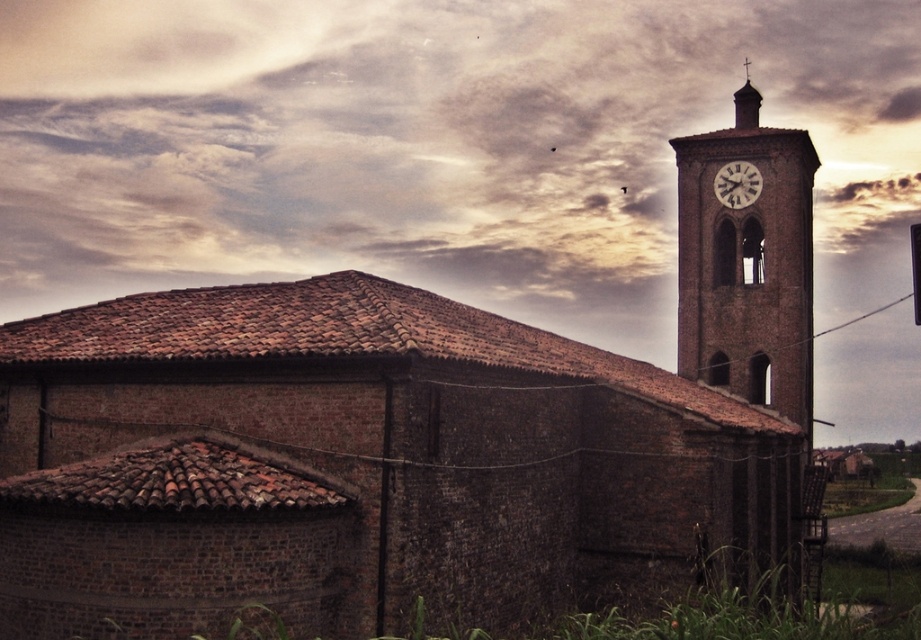
This screenshot has width=921, height=640. In order to click on white metallic clock at upper right in this screenshot , I will do `click(737, 182)`.

Which of these two, white metallic clock at upper right or smooth stone clock tower at upper right, stands taller?

smooth stone clock tower at upper right

Between point (749, 192) and point (747, 65), which one is positioned behind?

Positioned behind is point (747, 65).

This screenshot has width=921, height=640. I want to click on white metallic clock at upper right, so click(x=737, y=182).

Does brown brick clock tower at upper right lie behind smooth stone clock tower at upper right?

No, it is in front of smooth stone clock tower at upper right.

Is point (775, 150) positioned in front of point (740, 122)?

That is True.

Locate an element on the screen. Image resolution: width=921 pixels, height=640 pixels. brown brick clock tower at upper right is located at coordinates (747, 269).

Can you confirm if cloudy sky at upper center is positioned to the left of smooth stone clock tower at upper right?

Indeed, cloudy sky at upper center is positioned on the left side of smooth stone clock tower at upper right.

You are a GUI agent. You are given a task and a screenshot of the screen. Output one action in this format:
    pyautogui.click(x=<x>, y=<y>)
    Task: Click on the cloudy sky at upper center
    
    Given the screenshot: What is the action you would take?
    pyautogui.click(x=437, y=147)

Locate an element on the screen. The image size is (921, 640). cloudy sky at upper center is located at coordinates (437, 147).